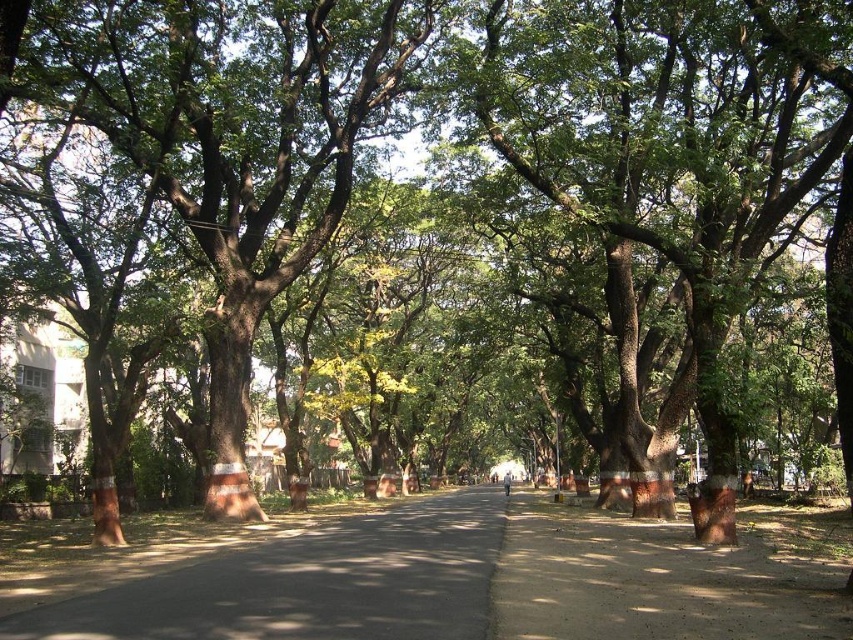
Question: Considering the relative positions of brown rough bark tree at center and brown dirt pavement at center in the image provided, where is brown rough bark tree at center located with respect to brown dirt pavement at center?

Choices:
 (A) below
 (B) above

Answer: (B)

Question: Which object appears closest to the camera in this image?

Choices:
 (A) dark asphalt road at center
 (B) brown rough bark tree at center

Answer: (A)

Question: Among these points, which one is nearest to the camera?

Choices:
 (A) (720, 28)
 (B) (78, 608)
 (C) (666, 624)

Answer: (C)

Question: Where is dark asphalt road at center located in relation to brown dirt pavement at center in the image?

Choices:
 (A) below
 (B) above

Answer: (A)

Question: Does brown rough bark tree at center appear under brown dirt pavement at center?

Choices:
 (A) no
 (B) yes

Answer: (A)

Question: Which of these objects is positioned closest to the brown dirt pavement at center?

Choices:
 (A) brown rough bark tree at center
 (B) dark asphalt road at center

Answer: (B)